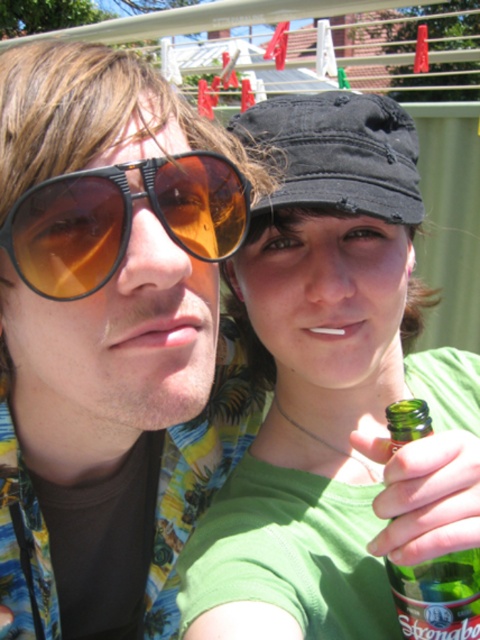
Question: Which is farther from the green glass bottle at lower right?

Choices:
 (A) green matte bottle at center
 (B) matte black sunglasses at left

Answer: (B)

Question: Can you confirm if matte brown sunglasses at left is positioned below green glass bottle at lower right?

Choices:
 (A) yes
 (B) no

Answer: (B)

Question: Estimate the real-world distances between objects in this image. Which object is farther from the green matte bottle at center?

Choices:
 (A) matte brown sunglasses at left
 (B) matte black sunglasses at left
 (C) green glass bottle at lower right

Answer: (A)

Question: Is the position of green matte bottle at center more distant than that of green glass bottle at lower right?

Choices:
 (A) yes
 (B) no

Answer: (B)

Question: Does matte black sunglasses at left have a greater width compared to green glass bottle at lower right?

Choices:
 (A) no
 (B) yes

Answer: (B)

Question: Which point is closer to the camera?

Choices:
 (A) (23, 300)
 (B) (420, 433)

Answer: (B)